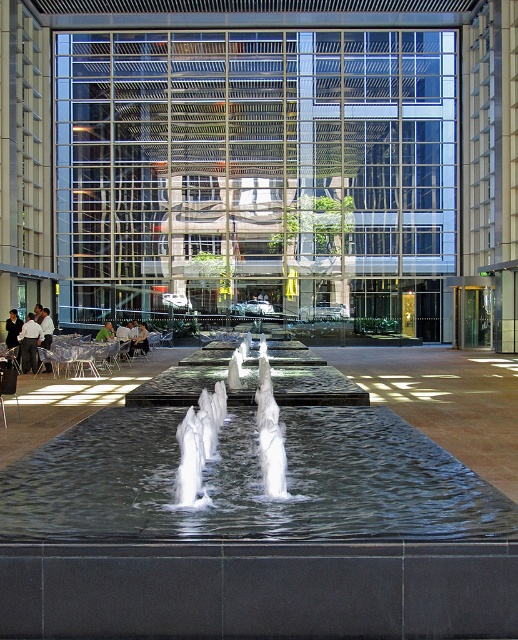
Measure the distance between clear water at center and clear water jets at center.

The distance of clear water at center from clear water jets at center is 1.35 meters.

Who is more distant from viewer, (207,468) or (196,490)?

Point (207,468)

Locate an element on the screen. This screenshot has height=640, width=518. clear water at center is located at coordinates coord(250,483).

In the scene shown: How far apart are clear water jets at center and white shirt at left?

clear water jets at center and white shirt at left are 7.83 meters apart from each other.

Between clear water jets at center and white shirt at left, which one has more height?

white shirt at left is taller.

Which is in front, point (280, 492) or point (32, 326)?

Positioned in front is point (280, 492).

Locate an element on the screen. clear water jets at center is located at coordinates (198, 444).

Does clear water at center come in front of white shirt at left?

Yes, clear water at center is closer to the viewer.

Is clear water at center below white shirt at left?

Yes.

Between point (338, 477) and point (26, 337), which one is positioned in front?

Point (338, 477)

Find the location of a particular element. clear water at center is located at coordinates (250, 483).